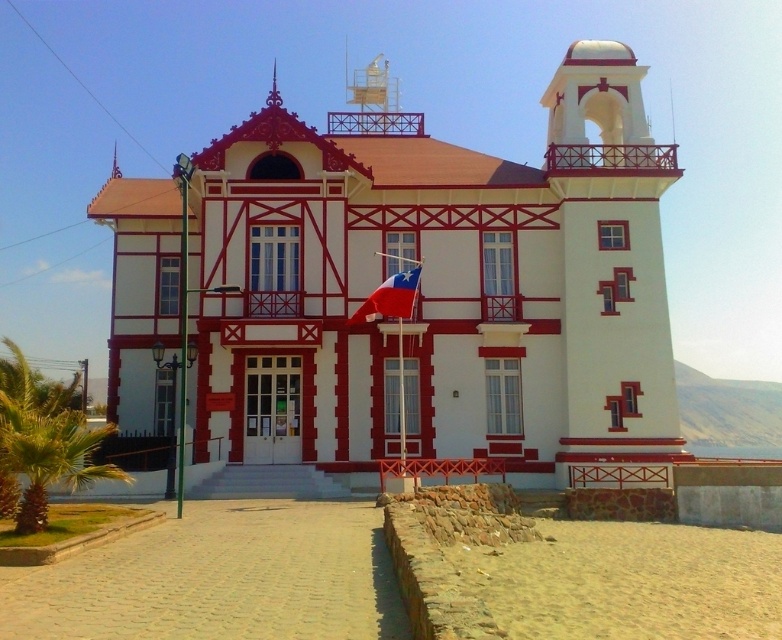
You are a photographer positioned in front of the building. You want to take a photo that includes both the white painted wood tower at center and the red fabric flag at center. Which object should be closer to the camera to ensure both are in focus?

The white painted wood tower at center is in front of the red fabric flag at center, so to ensure both are in focus, the photographer should position themselves so that the white painted wood tower at center is closer to the camera. This way, the tower and the flag behind it will be within the depth of field.

You are a photographer planning to capture the building with both the green leafy palm tree at lower left and the red fabric flag at center in the frame. Based on their heights, which object should you position closer to the camera to ensure both are fully visible?

The green leafy palm tree at lower left is taller than the red fabric flag at center, so you should position the green leafy palm tree at lower left closer to the camera to ensure both are fully visible.